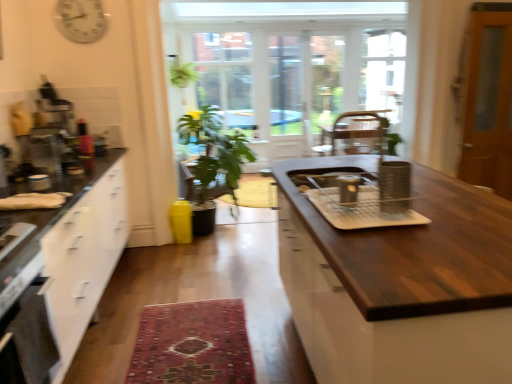
This screenshot has width=512, height=384. What are the coordinates of `white glossy clock at upper left` in the screenshot? It's located at (81, 20).

The height and width of the screenshot is (384, 512). Describe the element at coordinates (394, 186) in the screenshot. I see `metallic silver container at center, the 4th appliance when ordered from back to front` at that location.

The image size is (512, 384). Identify the location of clear glass tray at center, placed as the 5th appliance when sorted from back to front. (361, 209).

Measure the distance between clear glass tray at center, which is the second appliance from right to left, and camera.

4.91 feet.

The height and width of the screenshot is (384, 512). Describe the element at coordinates (39, 182) in the screenshot. I see `metallic silver toaster at left, which ranks as the second appliance in left-to-right order` at that location.

At what (x,y) coordinates should I click in order to perform the action: click on black matte oven at lower left. Please return your answer as a coordinate pair (x, y). This screenshot has height=384, width=512. Looking at the image, I should click on (28, 339).

Where is `green matte plant at center`? green matte plant at center is located at coordinates (213, 161).

Considering the points (58, 141) and (26, 335), which point is behind, point (58, 141) or point (26, 335)?

Positioned behind is point (58, 141).

From a real-world perspective, between metallic silver coffee machine at left, placed as the fifth appliance when sorted from right to left, and black matte oven at lower left, who is vertically lower?

black matte oven at lower left is physically lower.

From the picture: Would you say metallic silver coffee machine at left, placed as the first appliance when sorted from left to right, is to the left or to the right of black matte oven at lower left in the picture?

Clearly, metallic silver coffee machine at left, placed as the first appliance when sorted from left to right, is on the left of black matte oven at lower left in the image.

From the image's perspective, is metallic silver coffee machine at left, placed as the first appliance when sorted from left to right, under black matte oven at lower left?

No, from the image's perspective, metallic silver coffee machine at left, placed as the first appliance when sorted from left to right, is not beneath black matte oven at lower left.

Consider the image. From a real-world perspective, is metallic silver canister at center, placed as the third appliance when sorted from right to left, physically located above or below carpeted rug at center?

metallic silver canister at center, placed as the third appliance when sorted from right to left, is situated higher than carpeted rug at center in the real world.

Could carpeted rug at center be considered to be inside metallic silver canister at center, placed as the third appliance when sorted from right to left?

No, carpeted rug at center is not surrounded by metallic silver canister at center, placed as the third appliance when sorted from right to left.

Is metallic silver canister at center, marked as the 3th appliance in a back-to-front arrangement, oriented towards carpeted rug at center?

No, metallic silver canister at center, marked as the 3th appliance in a back-to-front arrangement, is not facing towards carpeted rug at center.

Considering the positions of objects metallic silver canister at center, which is the 3th appliance in left-to-right order, and carpeted rug at center in the image provided, who is more to the right, metallic silver canister at center, which is the 3th appliance in left-to-right order, or carpeted rug at center?

Positioned to the right is metallic silver canister at center, which is the 3th appliance in left-to-right order.

Can you tell me how much metallic silver toaster at left, the second appliance in the back-to-front sequence, and carpeted rug at center differ in facing direction?

metallic silver toaster at left, the second appliance in the back-to-front sequence, and carpeted rug at center are facing 90.5 degrees away from each other.

Which is correct: metallic silver toaster at left, placed as the 4th appliance when sorted from front to back, is inside carpeted rug at center, or outside of it?

The correct answer is: outside.

Who is taller, metallic silver toaster at left, placed as the 4th appliance when sorted from front to back, or carpeted rug at center?

Standing taller between the two is metallic silver toaster at left, placed as the 4th appliance when sorted from front to back.

Would you say carpeted rug at center is a long distance from wooden screen door at right?

That's right, there is a large distance between carpeted rug at center and wooden screen door at right.

From the image's perspective, which is below, carpeted rug at center or wooden screen door at right?

carpeted rug at center, from the image's perspective.

From the picture: Does carpeted rug at center have a lesser height compared to wooden screen door at right?

Yes, carpeted rug at center is shorter than wooden screen door at right.

Considering the relative sizes of carpeted rug at center and wooden screen door at right in the image provided, is carpeted rug at center thinner than wooden screen door at right?

In fact, carpeted rug at center might be wider than wooden screen door at right.

Is wooden screen door at right bigger than clear glass tray at center, placed as the 5th appliance when sorted from back to front?

Yes.

You are a GUI agent. You are given a task and a screenshot of the screen. Output one action in this format:
    pyautogui.click(x=<x>, y=<y>)
    Task: Click on the appliance that is the 5th one when counting downward from the wooden screen door at right (from the image's perspective)
    
    Given the screenshot: What is the action you would take?
    pyautogui.click(x=361, y=209)

How distant is wooden screen door at right from clear glass tray at center, the first appliance viewed from the front?

2.72 meters.

Is wooden screen door at right positioned with its back to clear glass tray at center, which is the second appliance from right to left?

wooden screen door at right does not have its back to clear glass tray at center, which is the second appliance from right to left.

Is the depth of wooden screen door at right greater than that of dark wood countertop at center?

Yes, it is.

Can you confirm if wooden screen door at right is smaller than dark wood countertop at center?

Yes, wooden screen door at right is smaller than dark wood countertop at center.

Is point (490, 30) closer or farther from the camera than point (307, 278)?

Point (490, 30).

In the image, is wooden screen door at right on the left side or the right side of dark wood countertop at center?

wooden screen door at right is to the right of dark wood countertop at center.

From a real-world perspective, which object rests below the other?

carpeted rug at center.

How many degrees apart are the facing directions of carpeted rug at center and white glossy clock at upper left?

The angle between the facing direction of carpeted rug at center and the facing direction of white glossy clock at upper left is 179 degrees.

Is carpeted rug at center turned away from white glossy clock at upper left?

No, carpeted rug at center's orientation is not away from white glossy clock at upper left.

Considering the sizes of objects carpeted rug at center and white glossy clock at upper left in the image provided, who is taller, carpeted rug at center or white glossy clock at upper left?

white glossy clock at upper left.

Where is `the 5th appliance behind when counting from the black matte oven at lower left`? The width and height of the screenshot is (512, 384). the 5th appliance behind when counting from the black matte oven at lower left is located at coordinates (42, 150).

From the carpeted rug at center, count 1st appliances forward and point to it. Please provide its 2D coordinates.

[(349, 189)]

Considering their positions, is wooden screen door at right positioned further to metallic silver coffee machine at left, placed as the first appliance when sorted from left to right, than white glossy clock at upper left?

wooden screen door at right lies further to metallic silver coffee machine at left, placed as the first appliance when sorted from left to right, than the other object.

When comparing their distances from black matte oven at lower left, does dark wood countertop at center or white glossy clock at upper left seem further?

white glossy clock at upper left is further to black matte oven at lower left.

Estimate the real-world distances between objects in this image. Which object is further from metallic silver coffee machine at left, the 1th appliance from the back, white glossy clock at upper left or carpeted rug at center?

carpeted rug at center is positioned further to the anchor metallic silver coffee machine at left, the 1th appliance from the back.

Consider the image. Looking at the image, which one is located closer to white glossy clock at upper left, green matte plant at center or black matte oven at lower left?

Based on the image, green matte plant at center appears to be nearer to white glossy clock at upper left.

From the picture: From the image, which object appears to be nearer to metallic silver coffee machine at left, acting as the 5th appliance starting from the front, wooden screen door at right or clear glass tray at center, placed as the 5th appliance when sorted from back to front?

clear glass tray at center, placed as the 5th appliance when sorted from back to front, is positioned closer to the anchor metallic silver coffee machine at left, acting as the 5th appliance starting from the front.

Considering their positions, is black matte oven at lower left positioned closer to dark wood countertop at center than metallic silver container at center, arranged as the 1th appliance when viewed from the right?

metallic silver container at center, arranged as the 1th appliance when viewed from the right, is positioned closer to the anchor dark wood countertop at center.

Considering their positions, is metallic silver toaster at left, which ranks as the second appliance in left-to-right order, positioned closer to dark wood countertop at center than green matte plant at center?

metallic silver toaster at left, which ranks as the second appliance in left-to-right order, lies closer to dark wood countertop at center than the other object.

From the image, which object appears to be farther from metallic silver container at center, arranged as the 1th appliance when viewed from the right, wooden screen door at right or white glossy clock at upper left?

white glossy clock at upper left is positioned further to the anchor metallic silver container at center, arranged as the 1th appliance when viewed from the right.

At what (x,y) coordinates should I click in order to perform the action: click on cabinetry situated between metallic silver coffee machine at left, placed as the first appliance when sorted from left to right, and wooden screen door at right from left to right. Please return your answer as a coordinate pair (x, y). Image resolution: width=512 pixels, height=384 pixels. Looking at the image, I should click on (400, 284).

Where is `clock between clear glass tray at center, which is the second appliance from right to left, and green matte plant at center from front to back`? The height and width of the screenshot is (384, 512). clock between clear glass tray at center, which is the second appliance from right to left, and green matte plant at center from front to back is located at coordinates (81, 20).

Find the location of `houseplant between white glossy clock at upper left and wooden screen door at right in the horizontal direction`. houseplant between white glossy clock at upper left and wooden screen door at right in the horizontal direction is located at coordinates (213, 161).

At what (x,y) coordinates should I click in order to perform the action: click on appliance between black matte oven at lower left and clear glass tray at center, placed as the 5th appliance when sorted from back to front, in the horizontal direction. Please return your answer as a coordinate pair (x, y). This screenshot has width=512, height=384. Looking at the image, I should click on (349, 189).